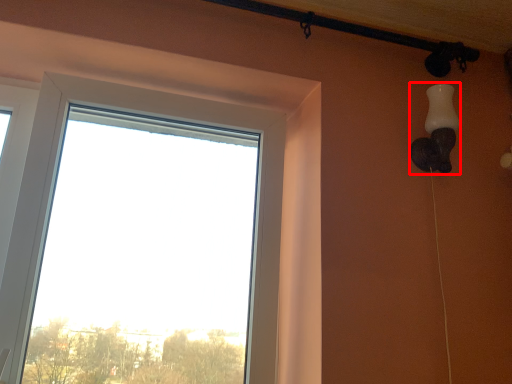
Question: From the image's perspective, what is the correct spatial relationship of lamp (annotated by the red box) in relation to window?

Choices:
 (A) above
 (B) below

Answer: (A)